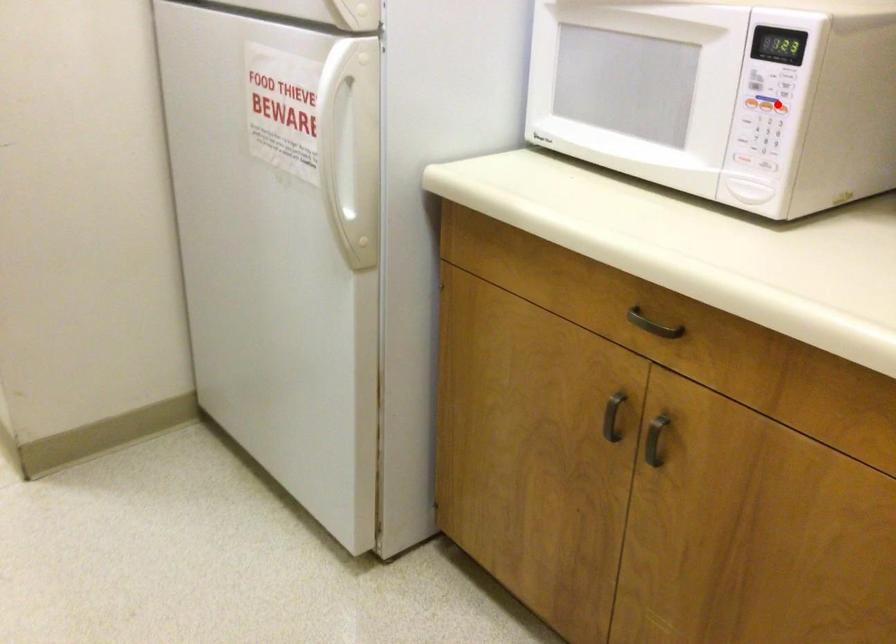
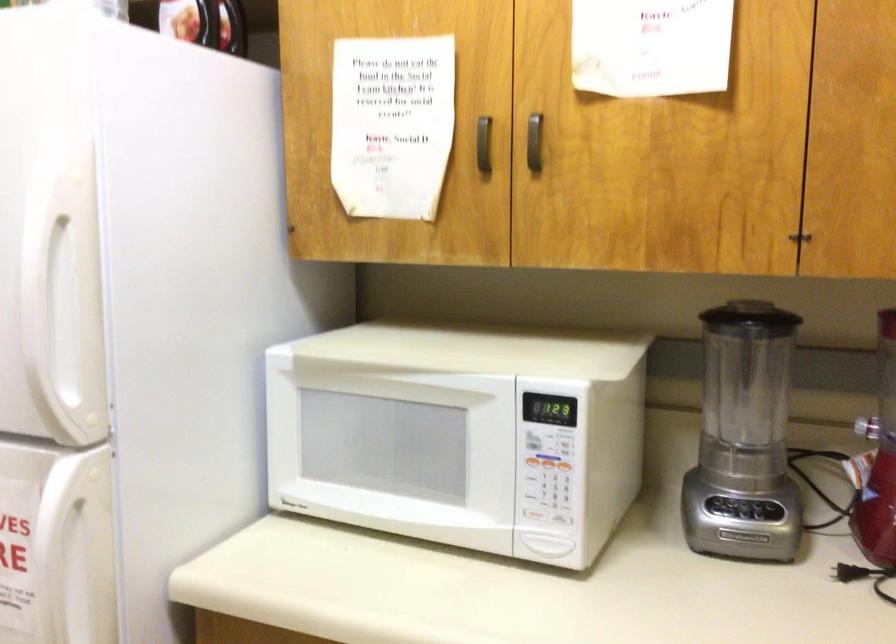
The point at the highlighted location is marked in the first image. Where is the corresponding point in the second image?

(565, 467)